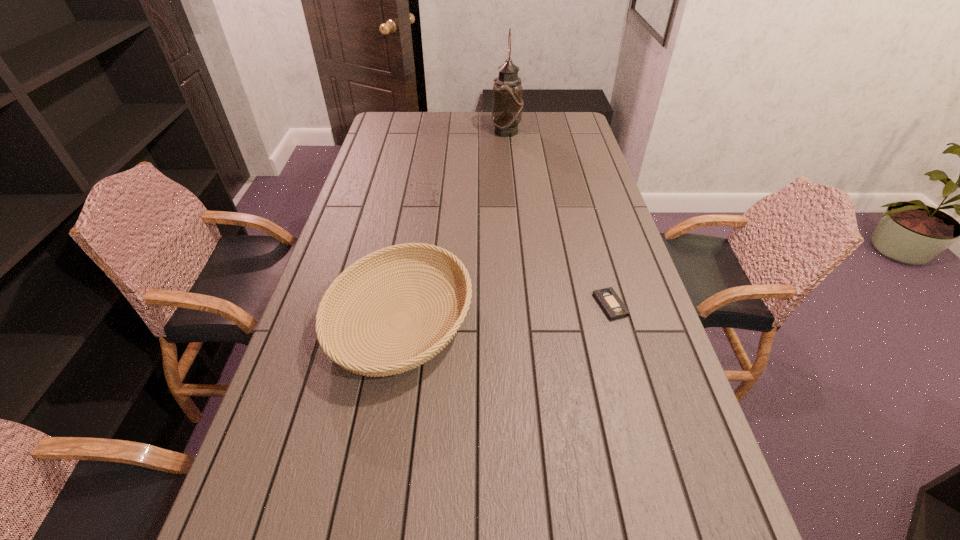
Identify the location of free region located on the left of the videotape. This screenshot has height=540, width=960. (551, 305).

Locate an element on the screen. object that is at the far edge is located at coordinates (507, 103).

Locate an element on the screen. object located at the left edge is located at coordinates (326, 312).

The width and height of the screenshot is (960, 540). In order to click on object present at the right edge in this screenshot , I will do `click(607, 298)`.

At what (x,y) coordinates should I click in order to perform the action: click on vacant space at the far edge. Please return your answer as a coordinate pair (x, y). This screenshot has width=960, height=540. Looking at the image, I should click on pyautogui.click(x=533, y=111).

At what (x,y) coordinates should I click in order to perform the action: click on vacant space at the left edge of the desktop. Please return your answer as a coordinate pair (x, y). The width and height of the screenshot is (960, 540). Looking at the image, I should click on (303, 511).

Where is `vacant space at the right edge of the desktop`? vacant space at the right edge of the desktop is located at coordinates (644, 399).

In the image, there is a desktop. At what (x,y) coordinates should I click in order to perform the action: click on vacant space at the far left corner. Please return your answer as a coordinate pair (x, y). Looking at the image, I should click on (397, 123).

In the image, there is a desktop. At what (x,y) coordinates should I click in order to perform the action: click on vacant space at the far right corner. Please return your answer as a coordinate pair (x, y). The width and height of the screenshot is (960, 540). Looking at the image, I should click on (582, 134).

At what (x,y) coordinates should I click in order to perform the action: click on unoccupied position between the third shortest object and the shortest object. Please return your answer as a coordinate pair (x, y). The height and width of the screenshot is (540, 960). Looking at the image, I should click on (505, 313).